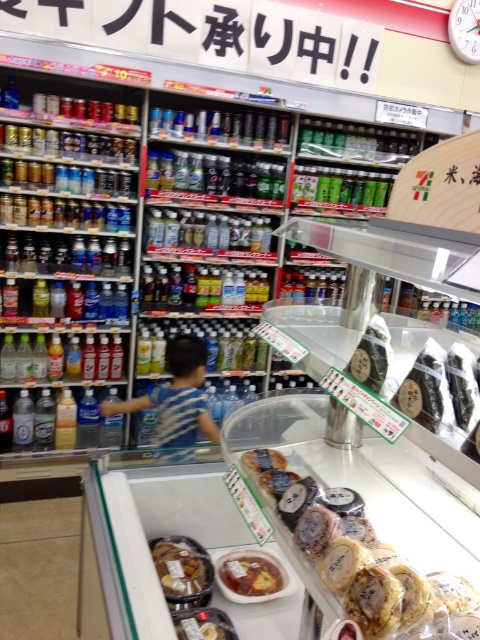
In the scene shown: You are a customer in a convenience store and want to place both the smooth brown pastry at center and the smooth yellow cake at center into a single plastic bag. The bag has a maximum capacity of 10 inches in length. Can both items fit side by side in the bag without overlapping?

The smooth brown pastry at center is 7.18 inches from the smooth yellow cake at center, so they can fit side by side in the bag since their combined distance is less than the bag capacity of 10 inches.

You are standing in front of the convenience store refrigerated section and display case. You see two points labeled as point (257, 570) and point (195, 632). Which point is closer to you?

Point (257, 570) is further to the camera than point (195, 632), so the point closer to you is point (195, 632).

You are a delivery person who needs to place a new snack box that is 40 centimeters wide into the display case. The case currently has a smooth yellow cake at center and a shiny plastic container at center. Can you fit the snack box between them without moving any existing items?

The distance between the smooth yellow cake at center and the shiny plastic container at center is 41.18 centimeters. Since the snack box is 40 centimeters wide, it can fit between them as the available space is slightly larger than the box.